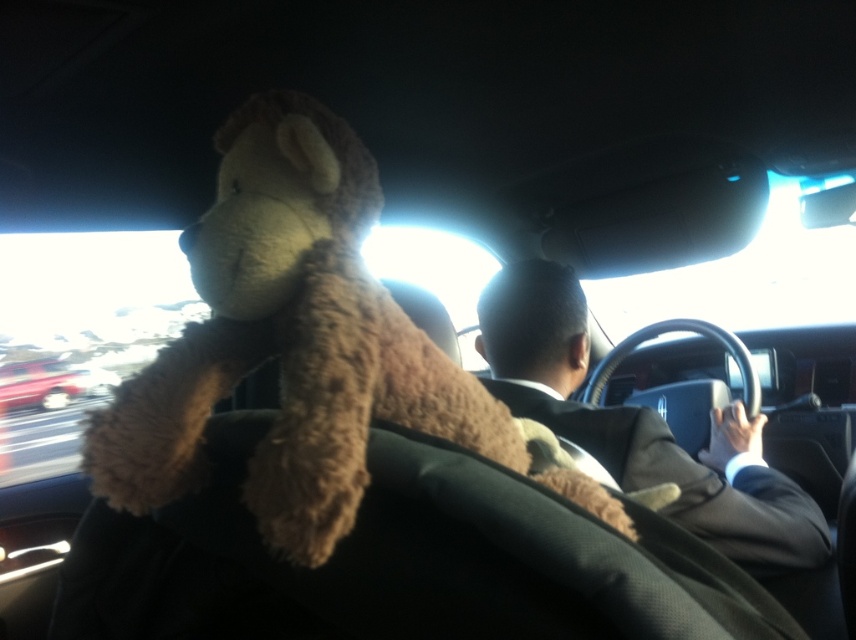
Question: Which object is positioned closest to the metallic red car at left?

Choices:
 (A) brown plush toy at center
 (B) dark brown suit at center

Answer: (B)

Question: Considering the real-world distances, which object is closest to the dark brown suit at center?

Choices:
 (A) metallic red car at left
 (B) brown plush toy at center

Answer: (B)

Question: Does brown plush toy at center have a larger size compared to dark brown suit at center?

Choices:
 (A) yes
 (B) no

Answer: (B)

Question: Does brown plush toy at center appear on the right side of metallic red car at left?

Choices:
 (A) yes
 (B) no

Answer: (A)

Question: Can you confirm if brown plush toy at center is positioned to the right of metallic red car at left?

Choices:
 (A) no
 (B) yes

Answer: (B)

Question: Which is farther from the brown plush toy at center?

Choices:
 (A) dark brown suit at center
 (B) metallic red car at left

Answer: (B)